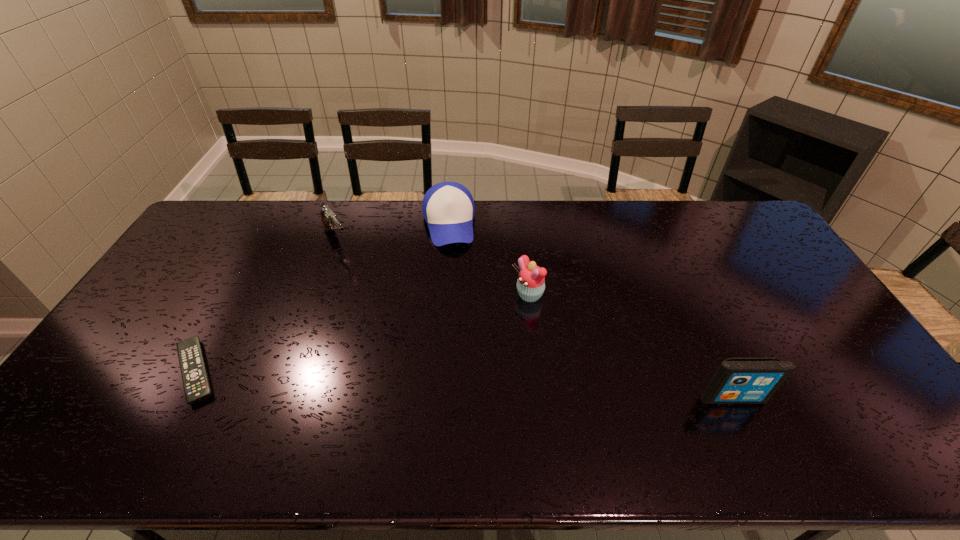
At what (x,y) coordinates should I click in order to perform the action: click on iPod that is at the near edge. Please return your answer as a coordinate pair (x, y). Image resolution: width=960 pixels, height=540 pixels. Looking at the image, I should click on pos(737,380).

Locate an element on the screen. This screenshot has width=960, height=540. vacant space at the far edge of the desktop is located at coordinates (303, 214).

Locate an element on the screen. Image resolution: width=960 pixels, height=540 pixels. free location at the near edge is located at coordinates (345, 398).

Find the location of a particular element. The height and width of the screenshot is (540, 960). vacant area at the left edge of the desktop is located at coordinates click(x=192, y=263).

I want to click on free space at the right edge, so click(x=817, y=357).

At what (x,y) coordinates should I click in order to perform the action: click on free location at the far left corner of the desktop. Please return your answer as a coordinate pair (x, y). The width and height of the screenshot is (960, 540). Looking at the image, I should click on (235, 224).

In order to click on vacant area at the far right corner in this screenshot , I will do click(715, 207).

At what (x,y) coordinates should I click in order to perform the action: click on vacant space at the near right corner. Please return your answer as a coordinate pair (x, y). The width and height of the screenshot is (960, 540). Looking at the image, I should click on (871, 396).

The image size is (960, 540). I want to click on free spot between the third object from right to left and the pistol, so click(393, 232).

Where is `vacant point located between the remote control and the iPod`? vacant point located between the remote control and the iPod is located at coordinates (464, 384).